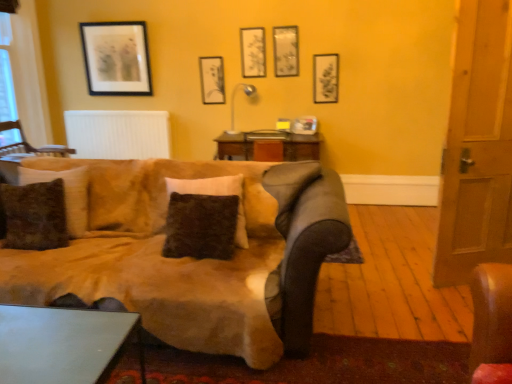
Question: Is wooden door at right bigger or smaller than wooden chair at left?

Choices:
 (A) small
 (B) big

Answer: (B)

Question: Is point (509, 8) positioned closer to the camera than point (48, 147)?

Choices:
 (A) closer
 (B) farther

Answer: (A)

Question: Which object is the closest to the white matte radiator at upper center?

Choices:
 (A) matte black picture frame at upper left, which ranks as the fifth picture frame in right-to-left order
 (B) brown fuzzy pillow at left, positioned as the 1th pillow in left-to-right order
 (C) matte black picture frame at upper right, the first picture frame in the right-to-left sequence
 (D) suede-like beige couch at center
 (E) matte black picture frame at upper center, marked as the 4th picture frame in a right-to-left arrangement

Answer: (A)

Question: Based on their relative distances, which object is nearer to the matte black picture frame at upper center, the fourth picture frame from the left?

Choices:
 (A) metallic gray table at lower left
 (B) white matte radiator at upper center
 (C) suede-like beige couch at center
 (D) wooden door at right
 (E) wooden chair at left

Answer: (B)